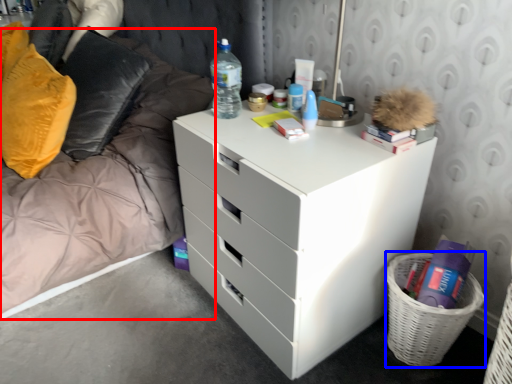
Question: Which object is closer to the camera taking this photo, bed frame (highlighted by a red box) or basket (highlighted by a blue box)?

Choices:
 (A) bed frame
 (B) basket

Answer: (A)